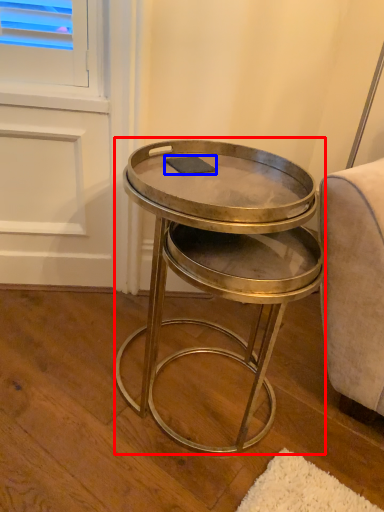
Question: Among these objects, which one is farthest to the camera, coffee table (highlighted by a red box) or pad (highlighted by a blue box)?

Choices:
 (A) coffee table
 (B) pad

Answer: (B)